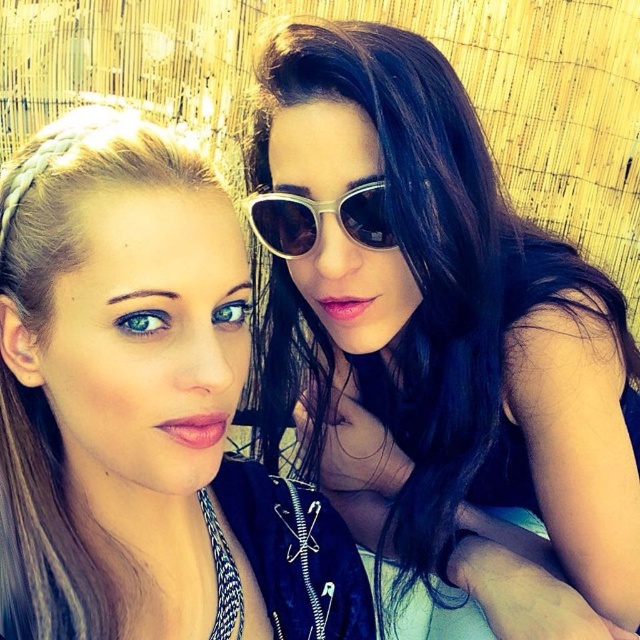
Can you confirm if matte black jacket at upper left is positioned to the right of metallic silver sunglasses at center?

In fact, matte black jacket at upper left is to the left of metallic silver sunglasses at center.

Can you confirm if matte black jacket at upper left is positioned to the left of metallic silver sunglasses at center?

Yes, matte black jacket at upper left is to the left of metallic silver sunglasses at center.

Who is more distant from viewer, (116, 323) or (285, 200)?

The point (285, 200) is more distant.

This screenshot has height=640, width=640. What are the coordinates of `matte black jacket at upper left` in the screenshot? It's located at (141, 410).

Who is lower down, satin black dress at upper right or matte black jacket at upper left?

matte black jacket at upper left is below.

Is satin black dress at upper right smaller than matte black jacket at upper left?

No.

At what (x,y) coordinates should I click in order to perform the action: click on satin black dress at upper right. Please return your answer as a coordinate pair (x, y). Looking at the image, I should click on (436, 342).

Can you confirm if satin black dress at upper right is bigger than metallic silver sunglasses at center?

Yes.

Describe the element at coordinates (436, 342) in the screenshot. The height and width of the screenshot is (640, 640). I see `satin black dress at upper right` at that location.

Find the location of a particular element. satin black dress at upper right is located at coordinates (436, 342).

Locate an element on the screen. satin black dress at upper right is located at coordinates (436, 342).